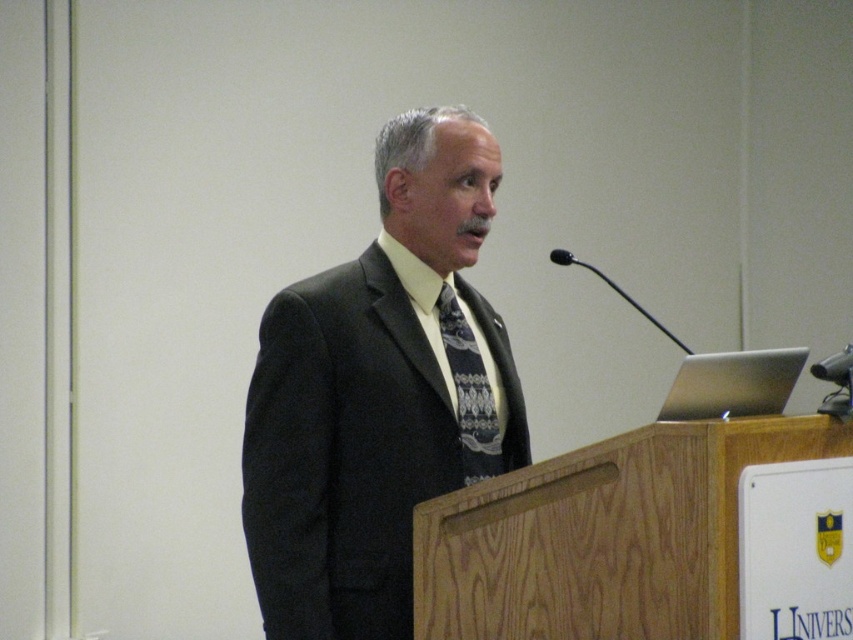
Consider the image. You are a photographer at the event and need to ensure the dark gray suit at center and dark blue textured tie at center are both visible in the photo. Given that the camera can only focus on objects within a certain height range, which one might be more challenging to capture clearly if the focus is set for the taller object?

The dark blue textured tie at center might be more challenging to capture clearly because it is shorter than the dark gray suit at center, so if the focus is set for the taller object, the shorter one could be out of focus range.

Based on the photo, you are a photographer positioned at the camera. You want to capture a closeup shot of the dark gray suit at center. Given that your camera can focus on objects within 5 feet, will you be able to take the closeup?

The dark gray suit at center is 6.04 feet away from the camera, which is beyond the 5 feet focusing range. Therefore, the camera cannot focus on it for a closeup.